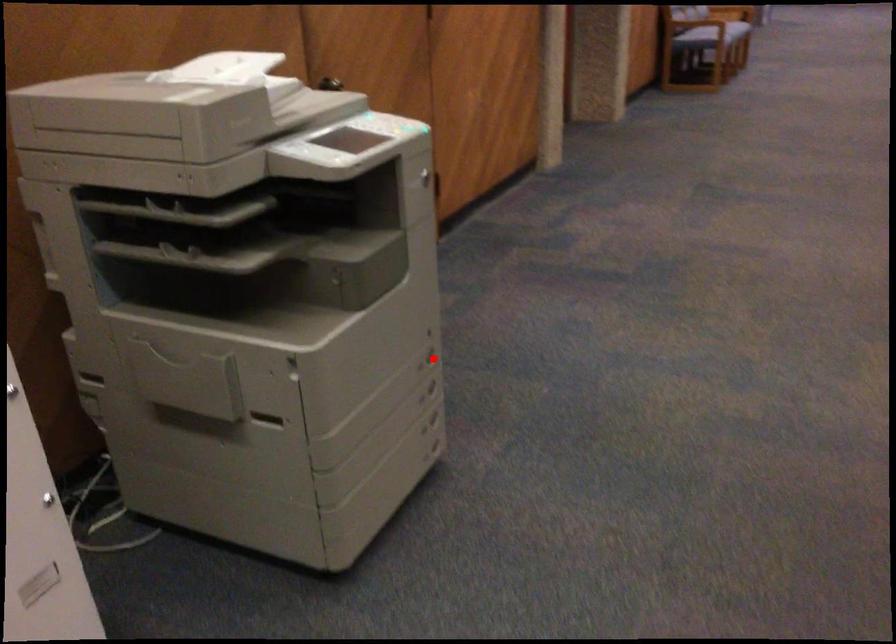
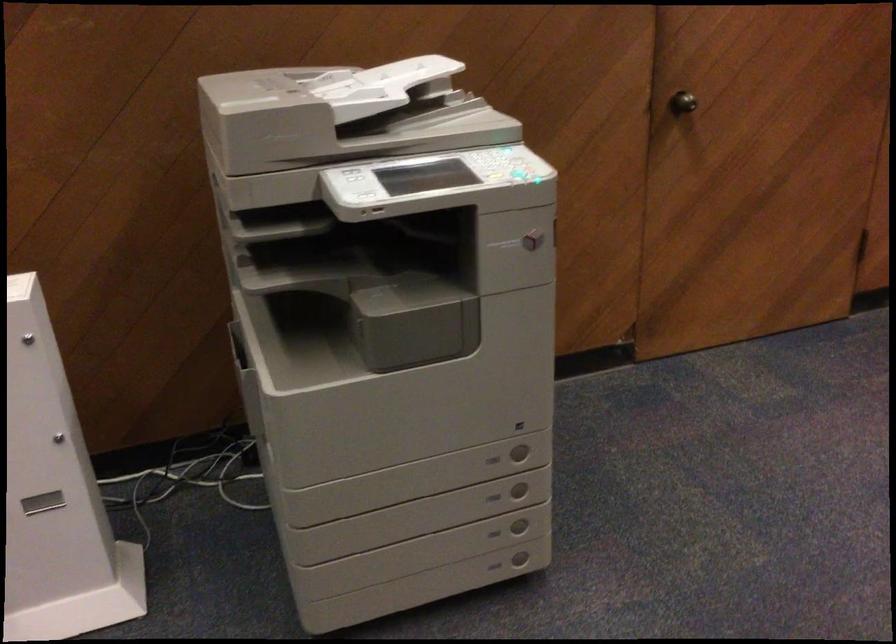
The point at the highlighted location is marked in the first image. Where is the corresponding point in the second image?

(519, 451)